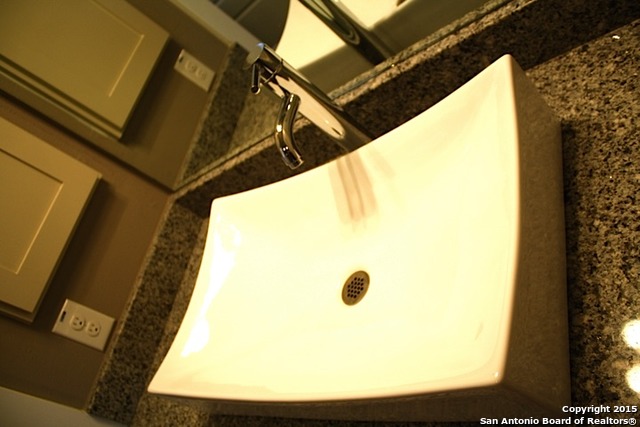
This screenshot has height=427, width=640. What are the coordinates of `electric plugs` in the screenshot? It's located at (92, 333), (75, 324).